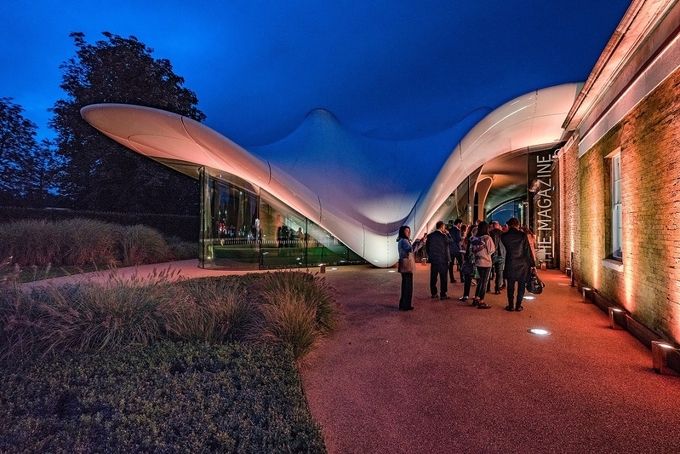
The width and height of the screenshot is (680, 454). Identify the location of window. (609, 230).